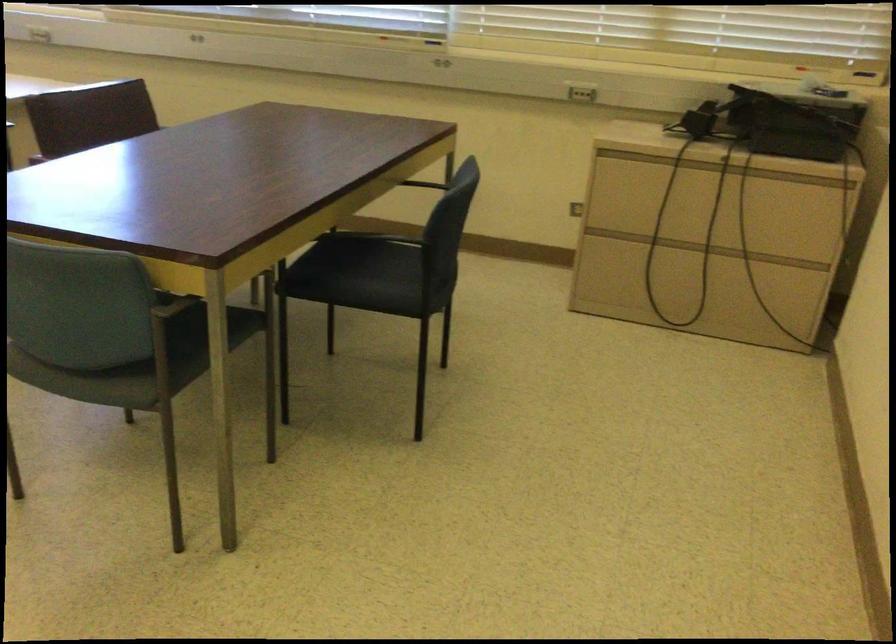
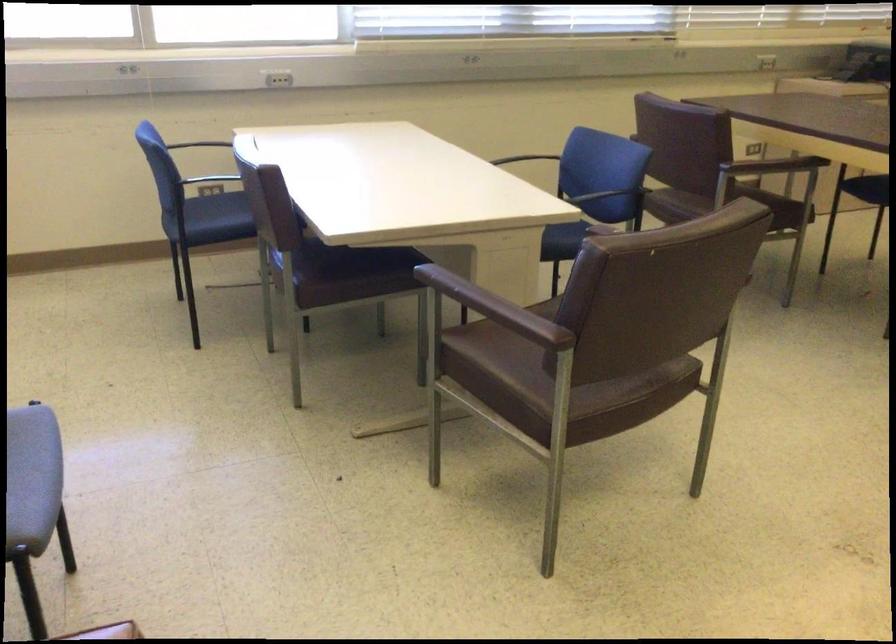
The point at (545,213) is marked in the first image. Where is the corresponding point in the second image?

(770, 152)